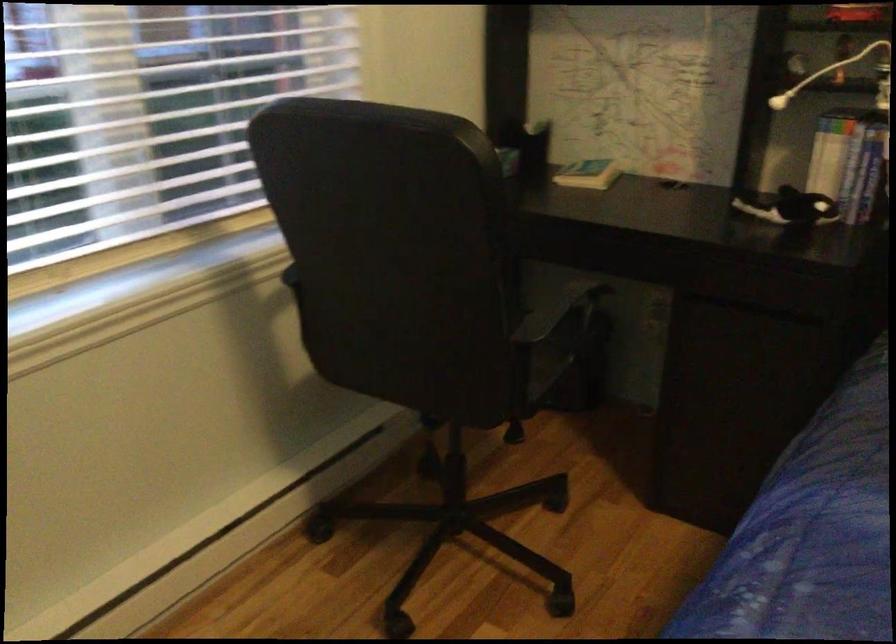
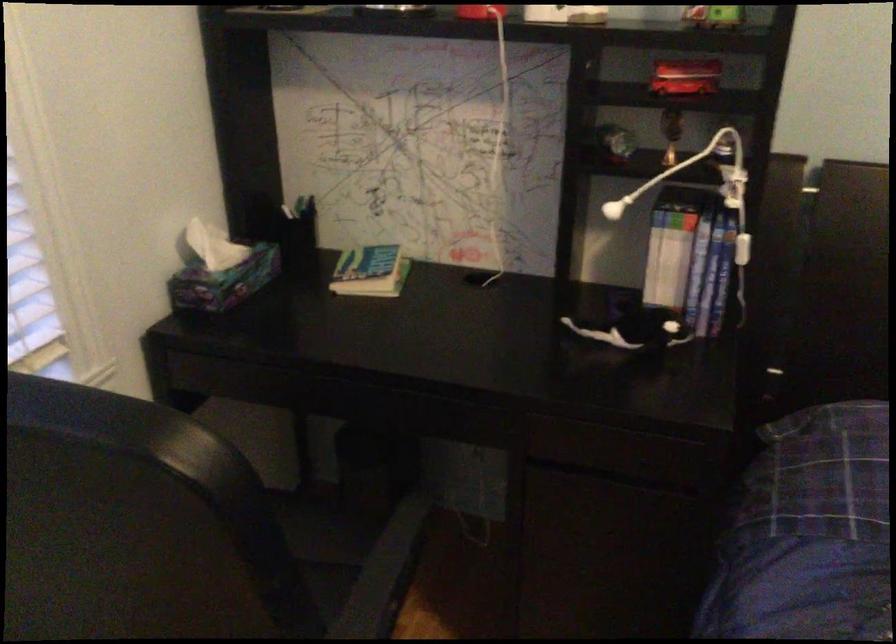
Question: The images are taken continuously from a first-person perspective. In which direction are you moving?

Choices:
 (A) Left
 (B) Right
 (C) Forward
 (D) Backward

Answer: (C)